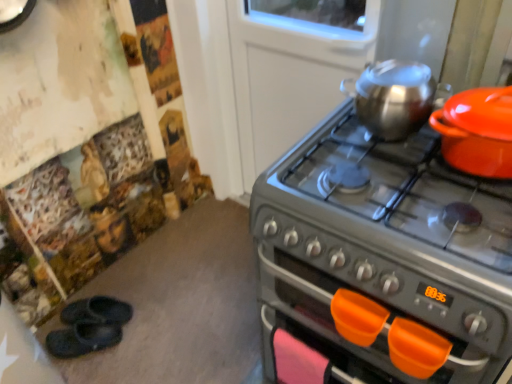
The width and height of the screenshot is (512, 384). In order to click on free space in front of matte orange pot at right, positioned as the 2th kitchen appliance in left-to-right order in this screenshot , I will do `click(475, 215)`.